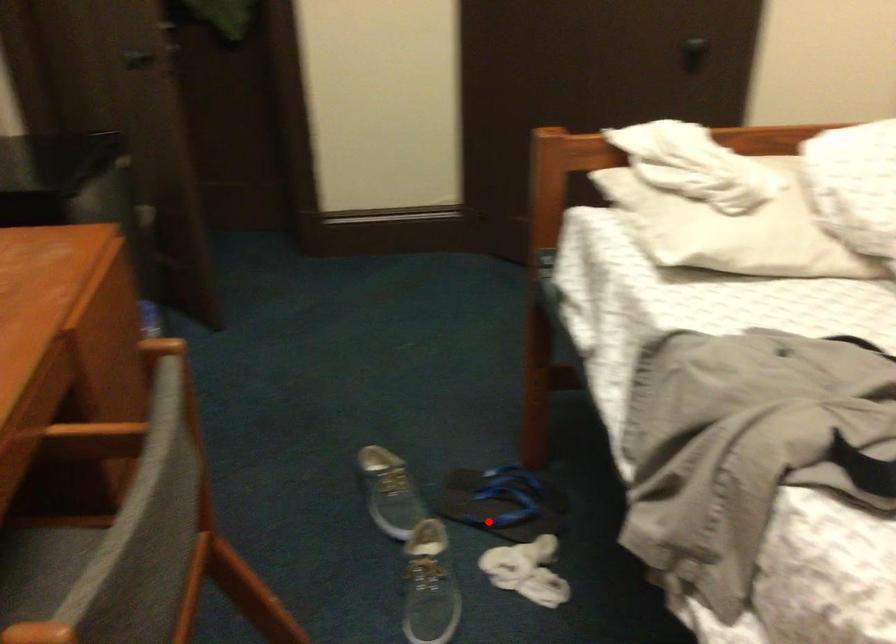
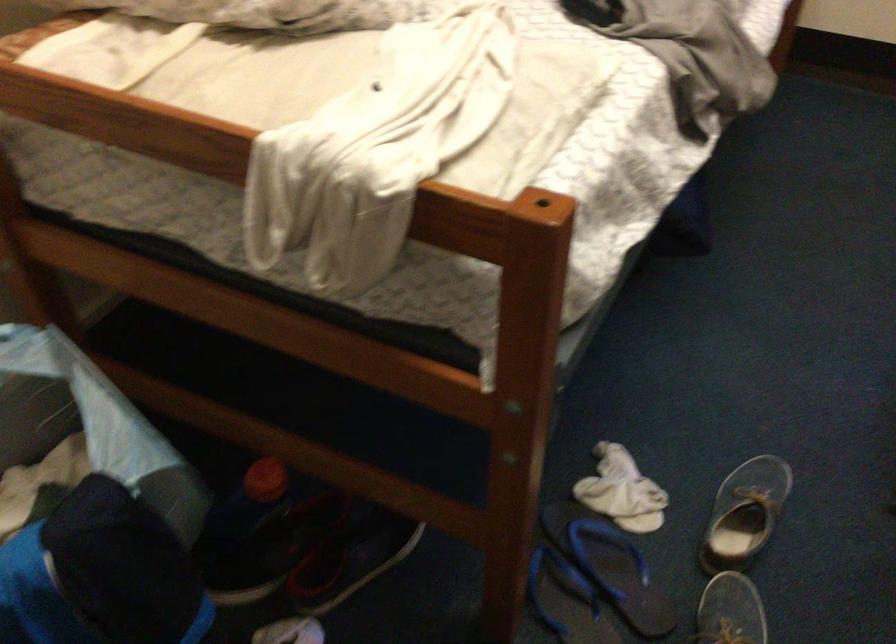
Question: I am providing you with two images of the same scene from different viewpoints. Given a red point in image1, look at the same physical point in image2. Is it:

Choices:
 (A) Closer to the viewpoint
 (B) Farther from the viewpoint

Answer: (A)